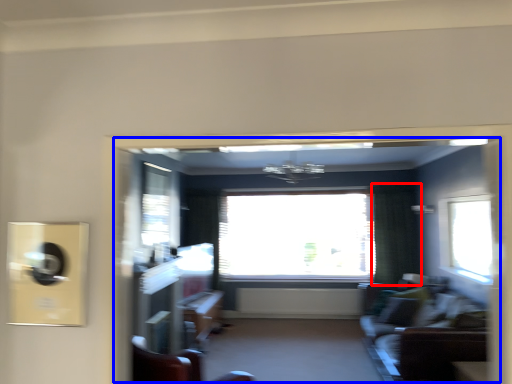
Question: Which of the following is the closest to the observer, curtain (highlighted by a red box) or hotel lobby (highlighted by a blue box)?

Choices:
 (A) curtain
 (B) hotel lobby

Answer: (B)